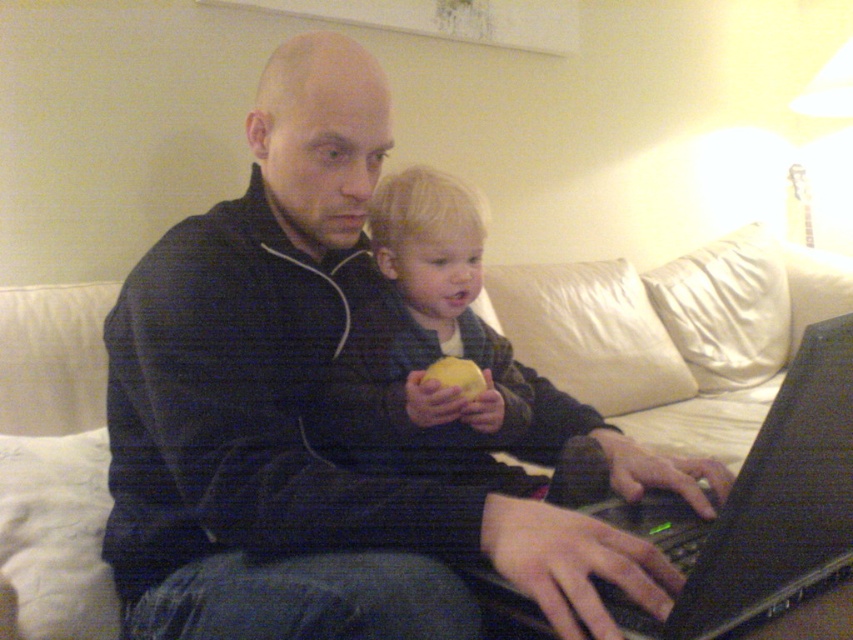
Between black plastic laptop at center and yellow matte apple at center, which one is positioned higher?

yellow matte apple at center is above.

Can you confirm if black plastic laptop at center is taller than yellow matte apple at center?

Yes.

Is point (817, 358) positioned in front of point (479, 394)?

Yes, it is in front of point (479, 394).

Image resolution: width=853 pixels, height=640 pixels. What are the coordinates of `black plastic laptop at center` in the screenshot? It's located at (759, 509).

Does black matte jacket at center have a smaller size compared to yellow matte apple at center?

No, black matte jacket at center is not smaller than yellow matte apple at center.

Who is more forward, (310, 122) or (474, 385)?

Point (310, 122) is more forward.

Locate an element on the screen. The width and height of the screenshot is (853, 640). black matte jacket at center is located at coordinates (300, 417).

From the picture: Is black matte jacket at center positioned at the back of black plastic laptop at center?

Yes, black matte jacket at center is behind black plastic laptop at center.

Which is in front, point (410, 595) or point (596, 506)?

Point (410, 595)

Which is in front, point (314, 472) or point (682, 518)?

Point (314, 472)

Find the location of a particular element. black matte jacket at center is located at coordinates (300, 417).